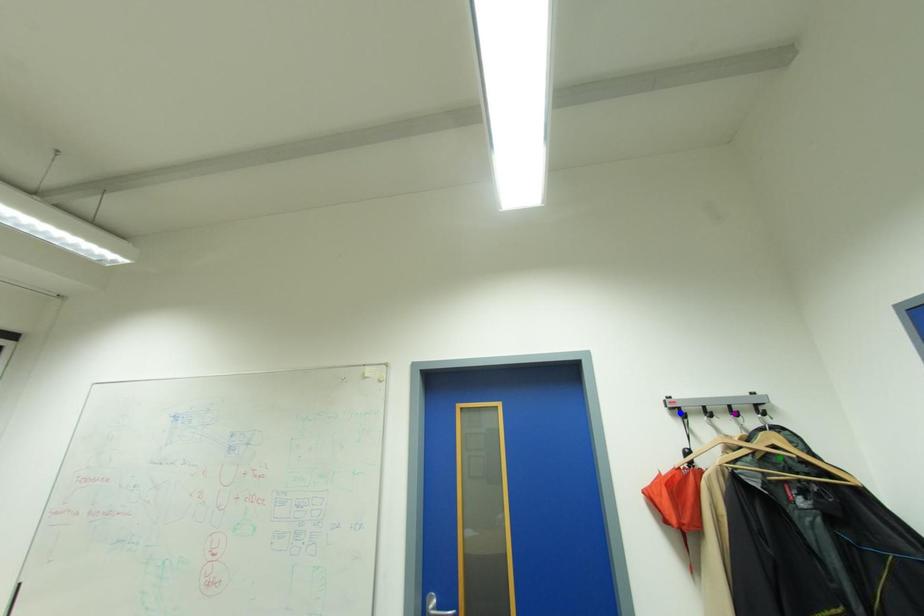
Order these from farthest to nearest:
1. blue point
2. purple point
3. green point

1. blue point
2. purple point
3. green point